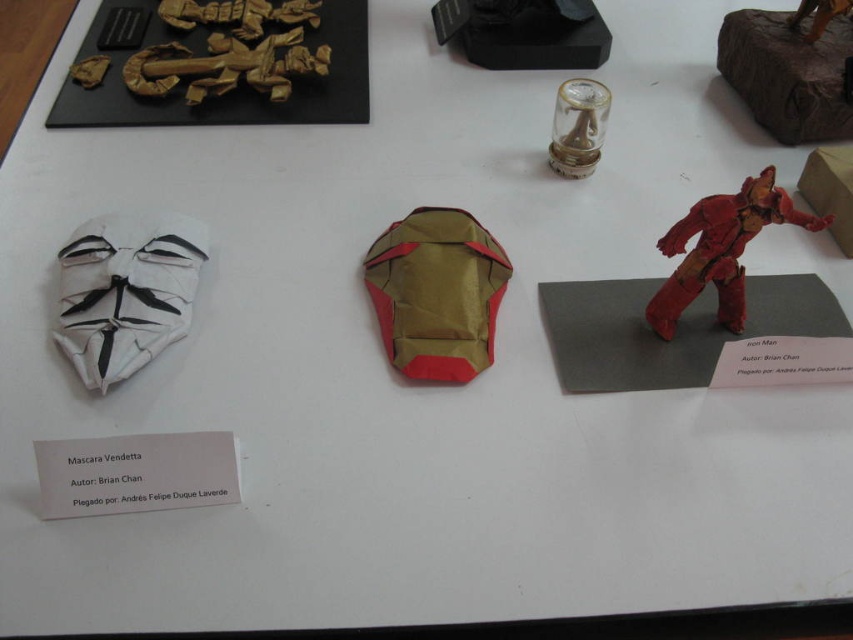
Is white paper mask at left positioned behind gold paper mask at center?

No, white paper mask at left is closer to the viewer.

Does white paper mask at left lie in front of gold paper mask at center?

Yes, white paper mask at left is in front of gold paper mask at center.

What do you see at coordinates (125, 292) in the screenshot? Image resolution: width=853 pixels, height=640 pixels. I see `white paper mask at left` at bounding box center [125, 292].

Identify the location of white paper mask at left. The image size is (853, 640). (125, 292).

Is red papier-mâché iron man at right in front of black matte figurine at upper center?

That is True.

Locate an element on the screen. red papier-mâché iron man at right is located at coordinates (721, 250).

Can you confirm if white paper mask at left is thinner than clear glass figurine at center?

In fact, white paper mask at left might be wider than clear glass figurine at center.

Can you confirm if white paper mask at left is taller than clear glass figurine at center?

Correct, white paper mask at left is much taller as clear glass figurine at center.

Is point (131, 314) less distant than point (578, 128)?

Yes, it is.

Find the location of `white paper mask at left`. white paper mask at left is located at coordinates (125, 292).